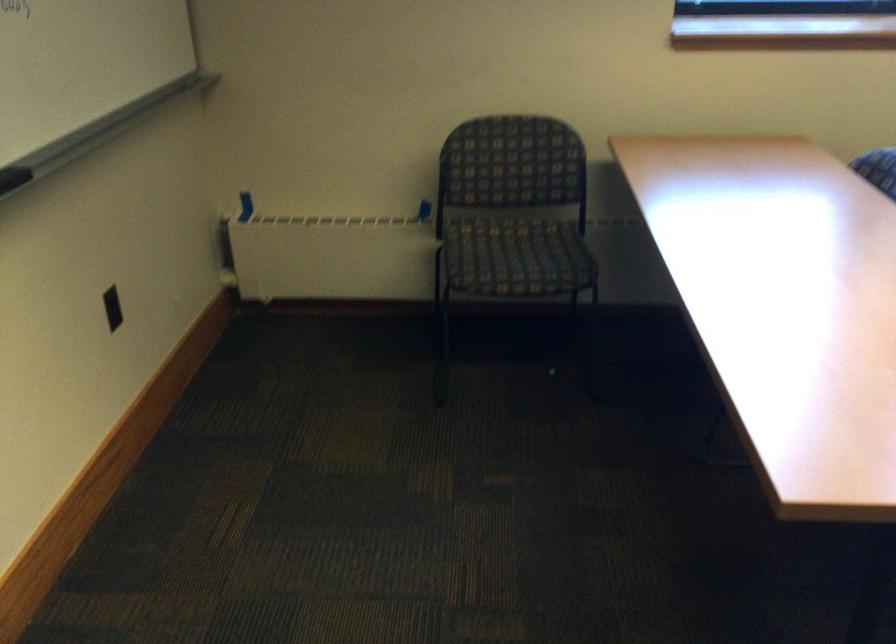
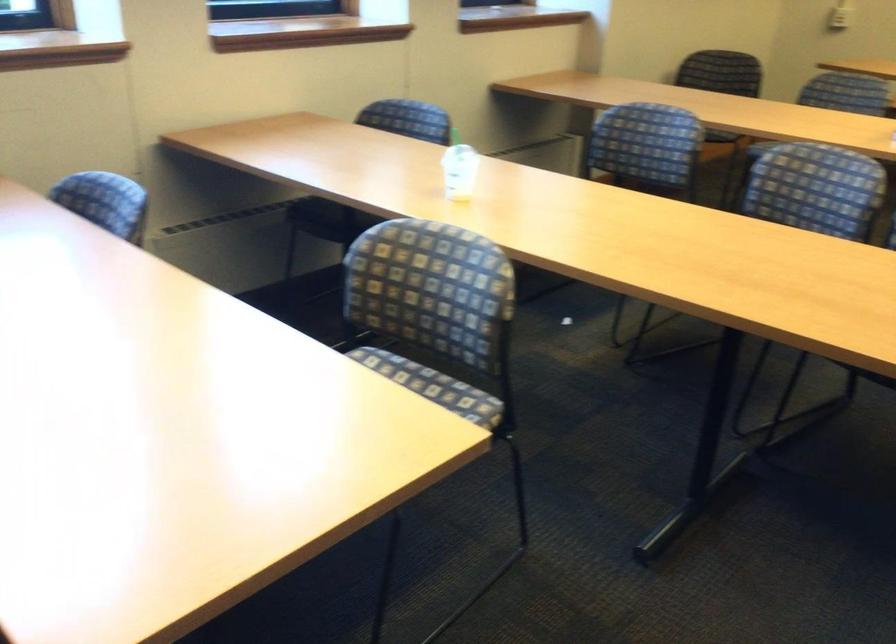
Question: The camera is either moving clockwise (left) or counter-clockwise (right) around the object. The first image is from the beginning of the video and the second image is from the end. Is the camera moving left or right when shooting the video?

Choices:
 (A) Left
 (B) Right

Answer: (A)